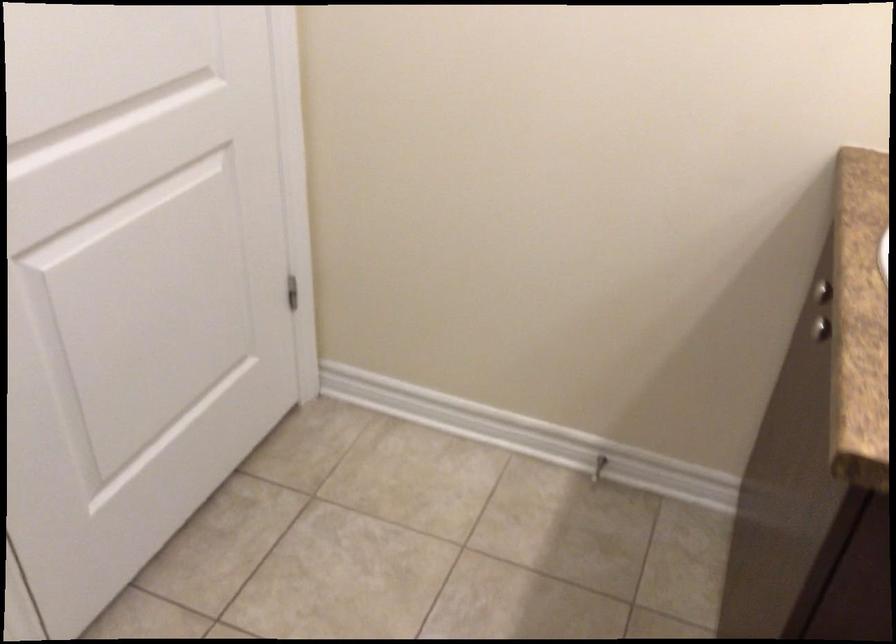
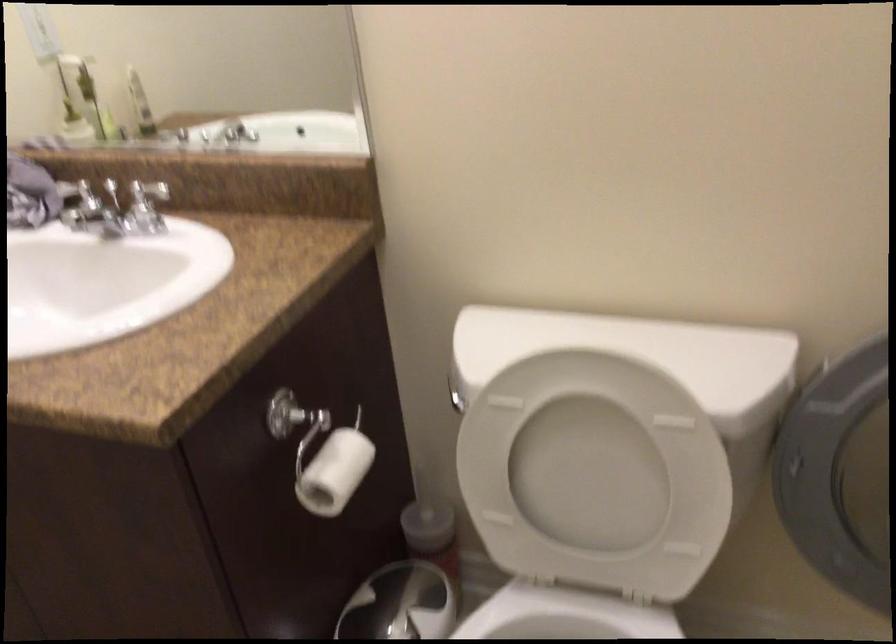
The images are taken continuously from a first-person perspective. In which direction is your viewpoint rotating?

The camera's rotation is toward right-down.